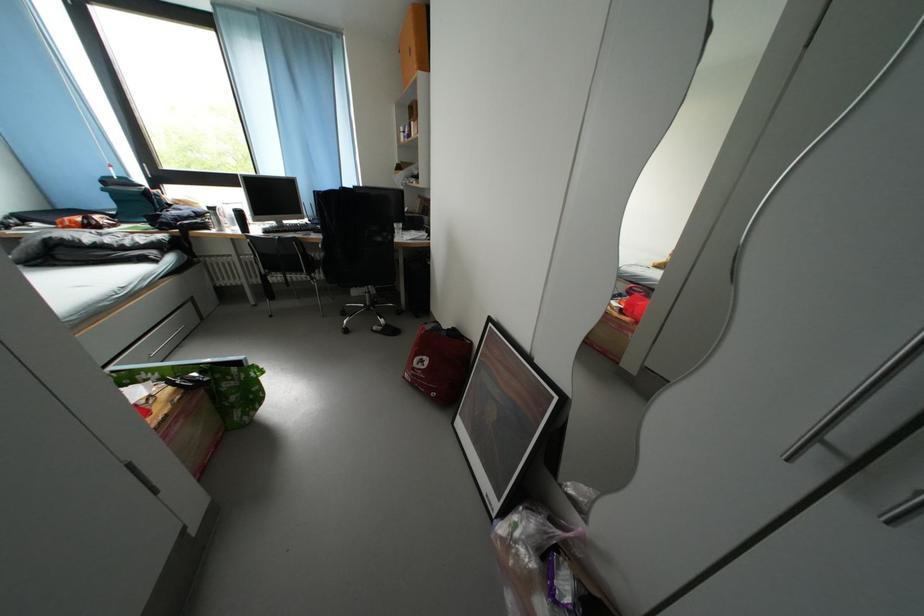
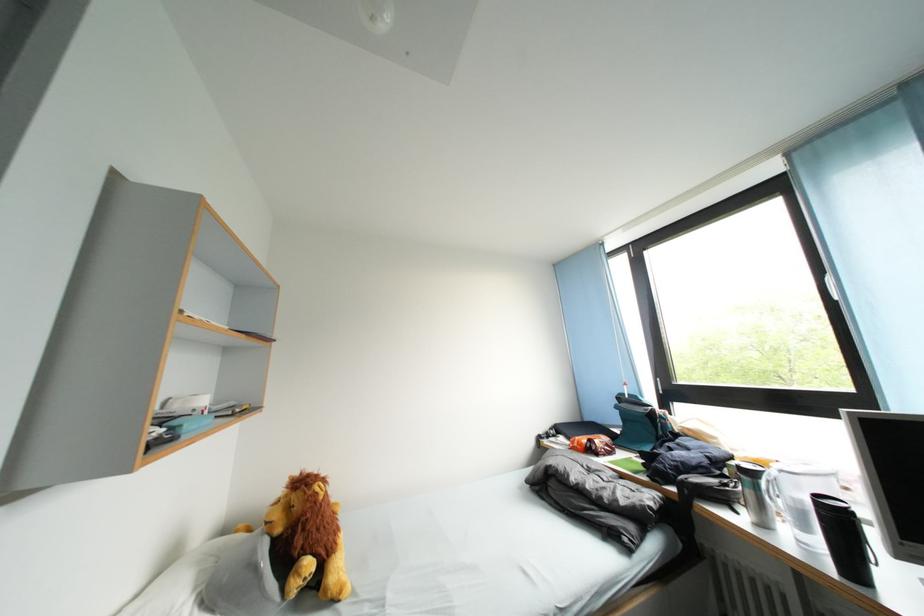
In the second image, find the point that corresponds to the point at 136,248 in the first image.

(614, 501)